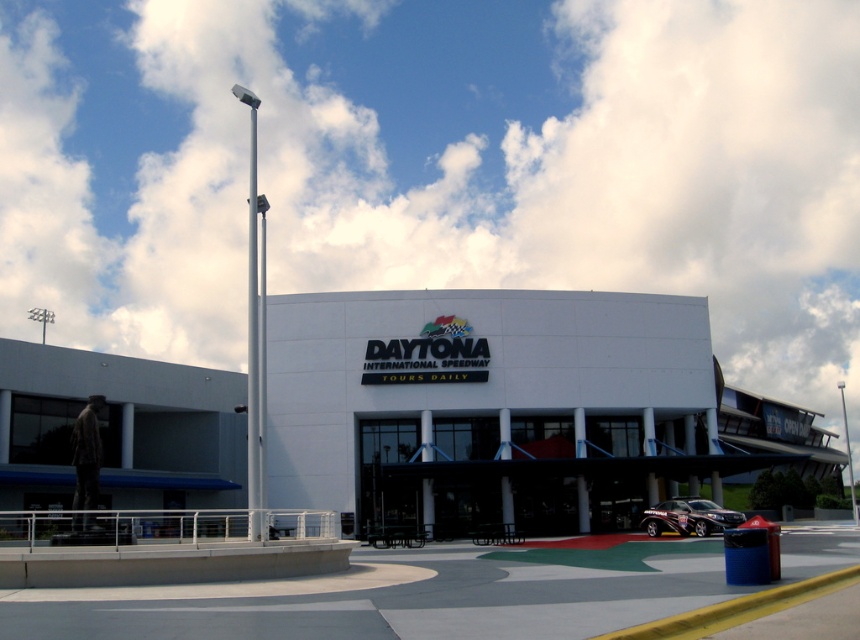
Which is above, shiny metallic car at lower right or metallic flag pole at right?

Positioned higher is shiny metallic car at lower right.

Can you confirm if shiny metallic car at lower right is positioned below metallic flag pole at right?

Actually, shiny metallic car at lower right is above metallic flag pole at right.

Between point (697, 506) and point (851, 490), which one is positioned behind?

The point (851, 490) is behind.

You are a GUI agent. You are given a task and a screenshot of the screen. Output one action in this format:
    pyautogui.click(x=<x>, y=<y>)
    Task: Click on the shiny metallic car at lower right
    The height and width of the screenshot is (640, 860).
    Given the screenshot: What is the action you would take?
    pyautogui.click(x=688, y=516)

Looking at this image, who is positioned more to the right, white smooth building at center or shiny metallic car at lower right?

Positioned to the right is white smooth building at center.

Can you confirm if white smooth building at center is positioned to the left of shiny metallic car at lower right?

No, white smooth building at center is not to the left of shiny metallic car at lower right.

Who is more distant from viewer, (379,401) or (728,524)?

Positioned behind is point (379,401).

Where is `white smooth building at center`? Image resolution: width=860 pixels, height=640 pixels. white smooth building at center is located at coordinates (508, 408).

Is white smooth building at center thinner than metallic flag pole at right?

Correct, white smooth building at center's width is less than metallic flag pole at right's.

Which is more to the left, white smooth building at center or metallic flag pole at right?

From the viewer's perspective, white smooth building at center appears more on the left side.

Is point (511, 493) closer to viewer compared to point (851, 477)?

Yes, point (511, 493) is closer to viewer.

The height and width of the screenshot is (640, 860). Identify the location of white smooth building at center. (508, 408).